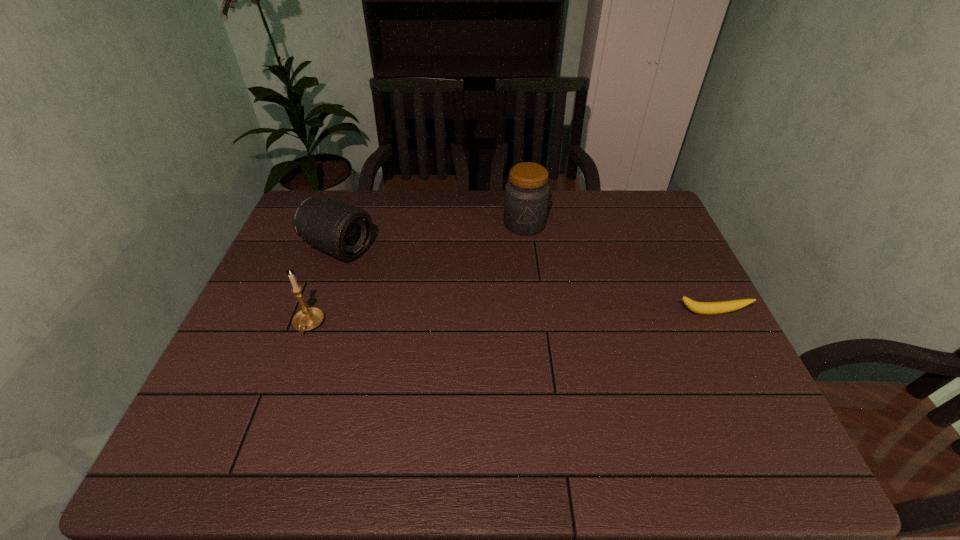
What are the coordinates of `vacant space that is in between the candle holder and the third tallest object` in the screenshot? It's located at (324, 287).

At what (x,y) coordinates should I click in order to perform the action: click on empty space between the candle holder and the rightmost object. Please return your answer as a coordinate pair (x, y). Looking at the image, I should click on (510, 319).

Locate an element on the screen. unoccupied area between the telephoto lens and the candle holder is located at coordinates (324, 287).

You are a GUI agent. You are given a task and a screenshot of the screen. Output one action in this format:
    pyautogui.click(x=<x>, y=<y>)
    Task: Click on the free space between the shortest object and the candle holder
    
    Given the screenshot: What is the action you would take?
    pyautogui.click(x=510, y=319)

At what (x,y) coordinates should I click in order to perform the action: click on object that stands as the closest to the candle holder. Please return your answer as a coordinate pair (x, y). This screenshot has height=540, width=960. Looking at the image, I should click on (344, 231).

Find the location of a particular element. This screenshot has width=960, height=540. the third closest object to the second shortest object is located at coordinates (704, 308).

This screenshot has width=960, height=540. I want to click on free space that satisfies the following two spatial constraints: 1. on the back side of the second shortest object; 2. on the right side of the third object from left to right, so click(348, 224).

At what (x,y) coordinates should I click in order to perform the action: click on vacant space that satisfies the following two spatial constraints: 1. on the back side of the second shortest object; 2. on the right side of the second object from right to left. Please return your answer as a coordinate pair (x, y). This screenshot has width=960, height=540. Looking at the image, I should click on (348, 224).